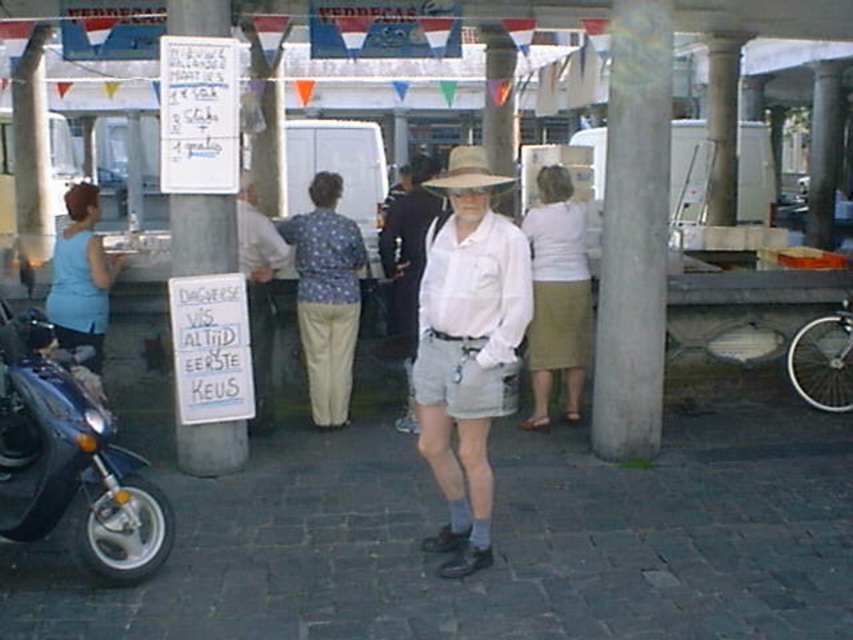
What is located at the coordinates point (556, 296) in the image?

The point (556, 296) corresponds to the light beige skirt at center.

Based on the scene description, where is the light beige skirt at center located in the image?

The light beige skirt at center is located at point 0.463 on the x axis and 0.654 on the y axis.